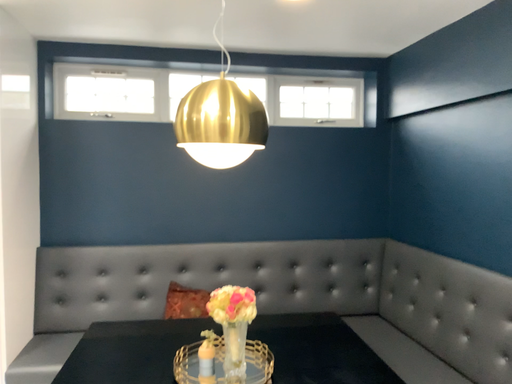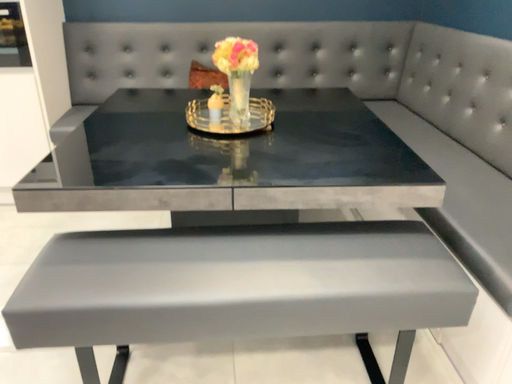
Question: How did the camera likely rotate when shooting the video?

Choices:
 (A) rotated downward
 (B) rotated upward

Answer: (A)